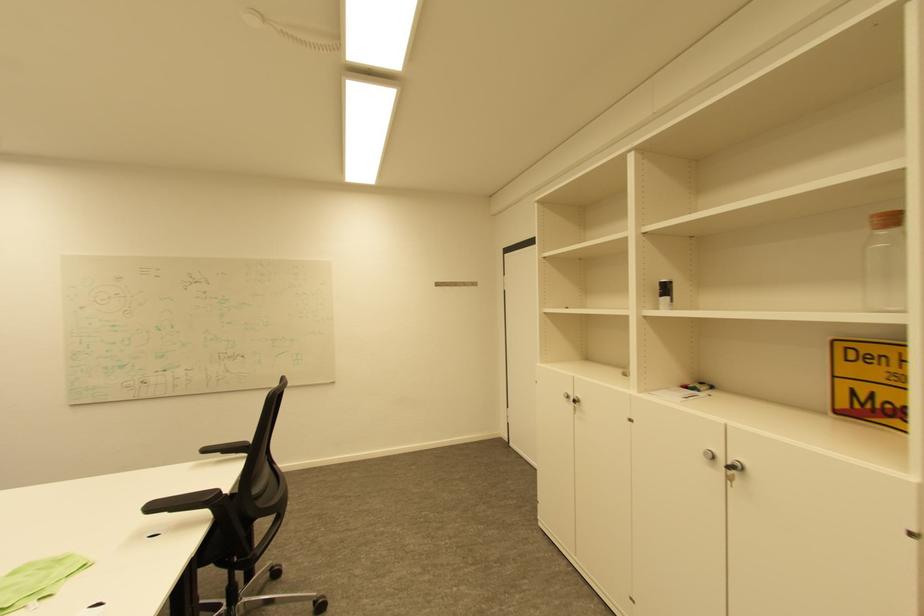
The location [885,262] corresponds to which object?

This point indicates the glass bottle.